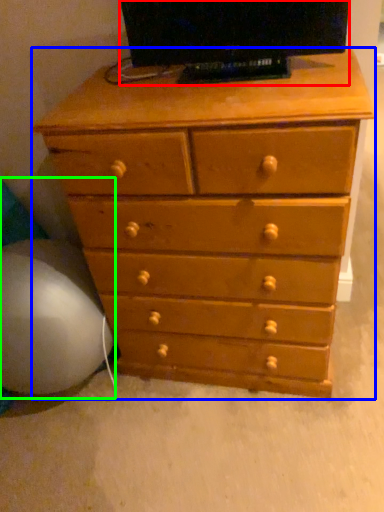
Question: Which object is the closest to the television (highlighted by a red box)? Choose among these: chest of drawers (highlighted by a blue box) or bean bag chair (highlighted by a green box).

Choices:
 (A) chest of drawers
 (B) bean bag chair

Answer: (A)